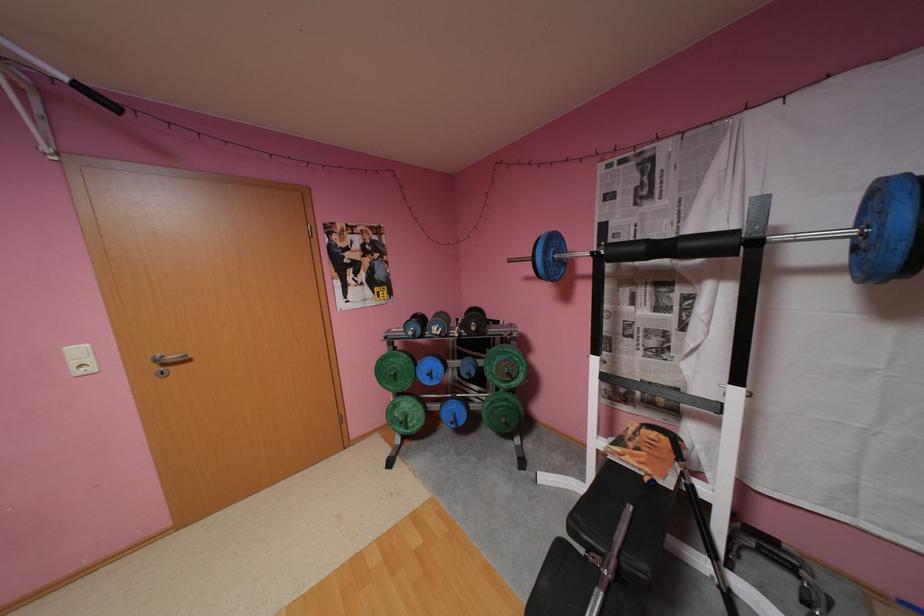
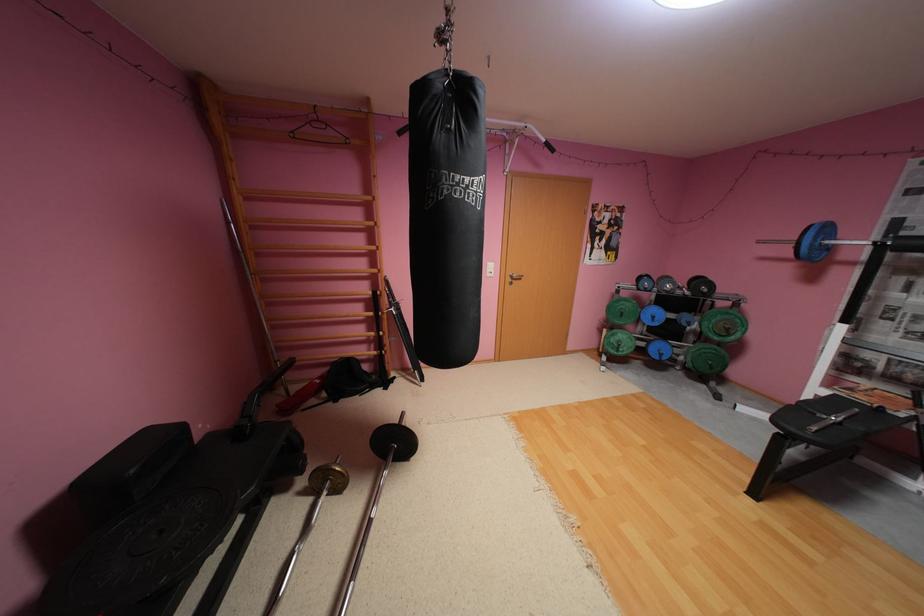
In a continuous first-person perspective shot, in which direction is the camera moving?

The cameraman moved toward left, backward.